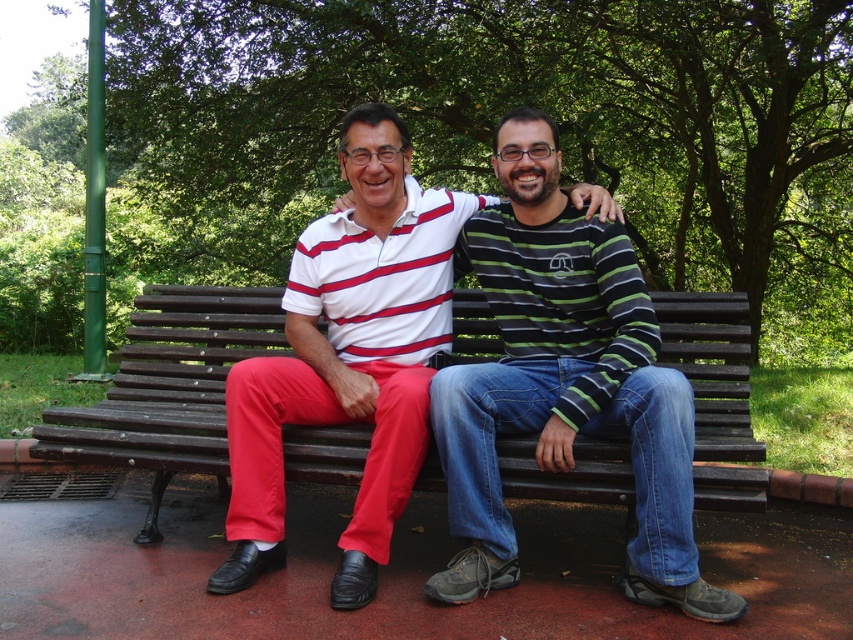
Question: Which object is closer to the camera taking this photo?

Choices:
 (A) striped cotton shirt at center
 (B) matte striped shirt at center
 (C) white striped polo shirt at center
 (D) wooden bench at center

Answer: (A)

Question: Is matte striped shirt at center smaller than white striped polo shirt at center?

Choices:
 (A) no
 (B) yes

Answer: (A)

Question: Which object is farther from the camera taking this photo?

Choices:
 (A) white striped polo shirt at center
 (B) wooden bench at center
 (C) matte striped shirt at center

Answer: (A)

Question: Is matte striped shirt at center to the left of white striped polo shirt at center from the viewer's perspective?

Choices:
 (A) no
 (B) yes

Answer: (B)

Question: Which object is the closest to the matte striped shirt at center?

Choices:
 (A) wooden bench at center
 (B) striped cotton shirt at center

Answer: (B)

Question: Does striped cotton shirt at center come behind matte striped shirt at center?

Choices:
 (A) yes
 (B) no

Answer: (B)